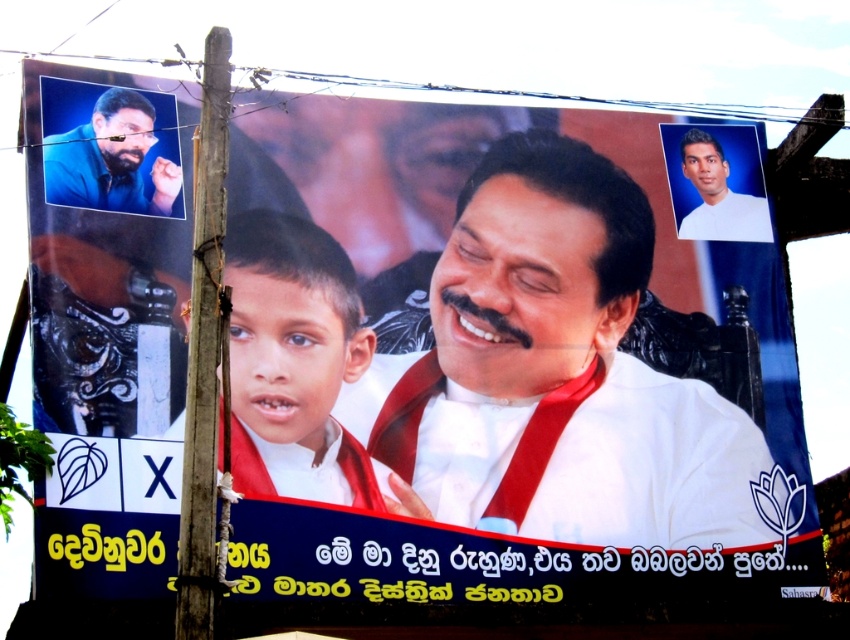
Question: Which object is farther from the camera taking this photo?

Choices:
 (A) white matte portrait at upper right
 (B) white glossy boy at center
 (C) white glossy shirt at center
 (D) matte blue shirt at upper left

Answer: (A)

Question: Which object appears closest to the camera in this image?

Choices:
 (A) white glossy shirt at center
 (B) white matte portrait at upper right
 (C) white glossy boy at center

Answer: (C)

Question: Is white glossy shirt at center in front of matte blue shirt at upper left?

Choices:
 (A) yes
 (B) no

Answer: (B)

Question: Is white glossy boy at center positioned before matte blue shirt at upper left?

Choices:
 (A) no
 (B) yes

Answer: (B)

Question: Which point is closer to the camera taking this photo?

Choices:
 (A) (723, 212)
 (B) (751, 524)
 (C) (94, 108)

Answer: (C)

Question: Is white glossy shirt at center above matte blue shirt at upper left?

Choices:
 (A) no
 (B) yes

Answer: (A)